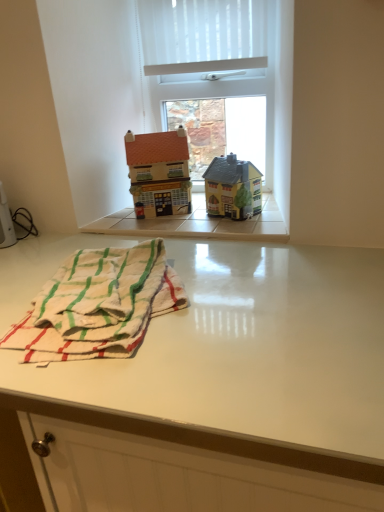
I want to click on vacant space to the right of white woven beach towel at lower left, so click(278, 310).